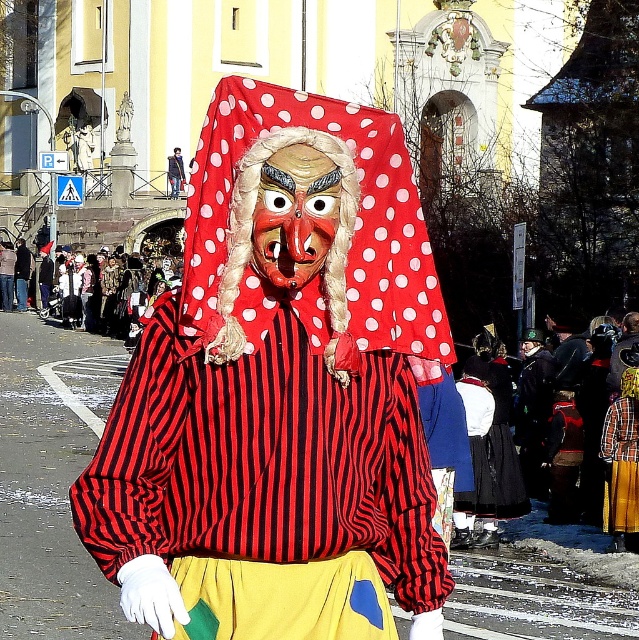
Who is shorter, matte red polka dot mask at center or polished wood mask at center?

polished wood mask at center

Is point (305, 264) farther from viewer compared to point (302, 220)?

That is True.

The image size is (639, 640). In order to click on matte red polka dot mask at center in this screenshot , I will do `click(281, 392)`.

Does matte red polka dot mask at center have a larger size compared to red polka dot fabric at center?

Yes.

Is point (224, 99) closer to viewer compared to point (371, 248)?

Yes.

At what (x,y) coordinates should I click in order to perform the action: click on matte red polka dot mask at center. Please return your answer as a coordinate pair (x, y). The height and width of the screenshot is (640, 639). Looking at the image, I should click on click(x=281, y=392).

The height and width of the screenshot is (640, 639). Identify the location of matte red polka dot mask at center. [281, 392].

Between red polka dot fabric at center and polished wood mask at center, which one is positioned higher?

polished wood mask at center

Which is in front, point (420, 234) or point (318, 266)?

Point (318, 266) is more forward.

Who is more distant from viewer, (212, 356) or (263, 250)?

Point (263, 250)

The image size is (639, 640). What are the coordinates of `red polka dot fabric at center` in the screenshot? It's located at (330, 243).